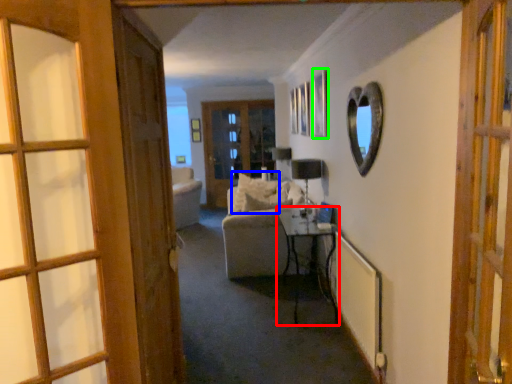
Question: Estimate the real-world distances between objects in this image. Which object is closer to table (highlighted by a red box), pillow (highlighted by a blue box) or picture frame (highlighted by a green box)?

Choices:
 (A) pillow
 (B) picture frame

Answer: (A)